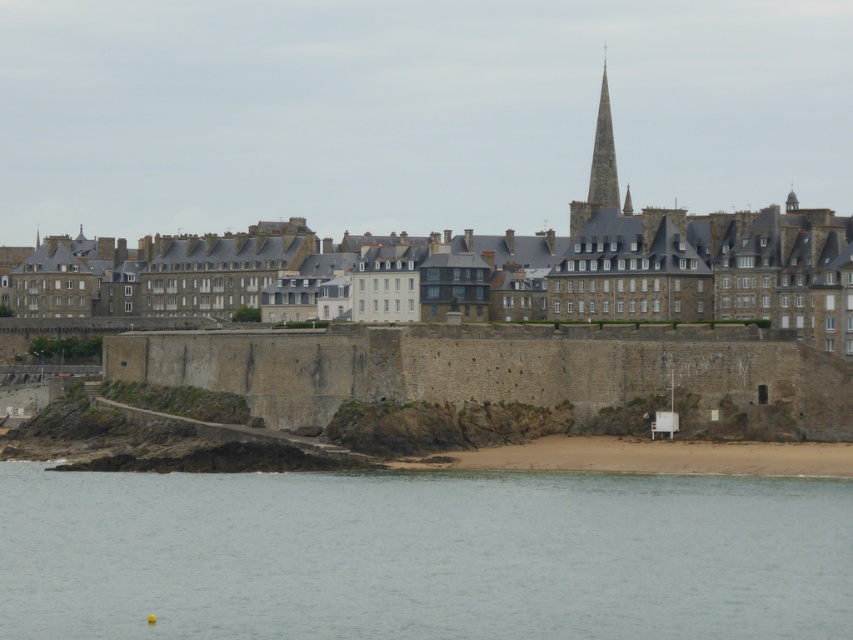
You are a tourist standing on the beach looking towards the town. You see the stone wall at center and the smooth stone spire at center. Which object is closer to the beach?

The stone wall at center is closer to the beach because it is located below the smooth stone spire at center.

You are standing at the center of the stone wall in the coastal town. You want to walk towards the clear water at lower center. Which direction should you face to walk straight towards it?

Since the clear water at lower center is located at point 0.867 on the x axis and 0.495 on the y axis, you should face towards the lower center direction to walk straight towards it.